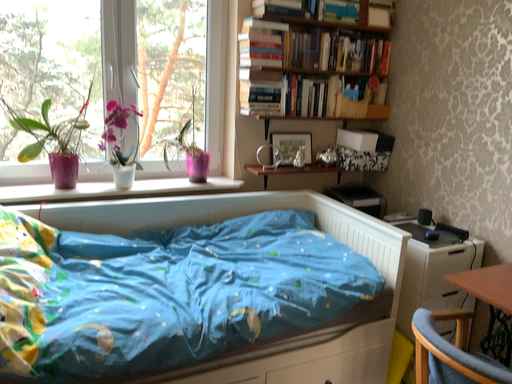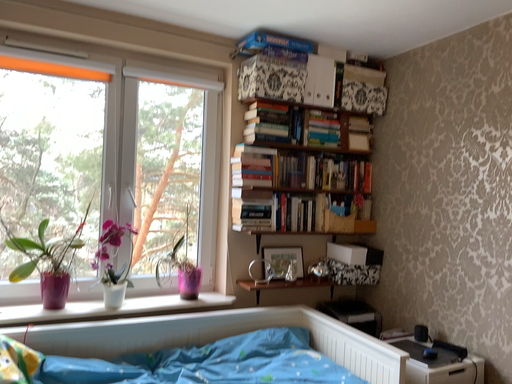
Question: Which way did the camera rotate in the video?

Choices:
 (A) rotated upward
 (B) rotated downward

Answer: (A)